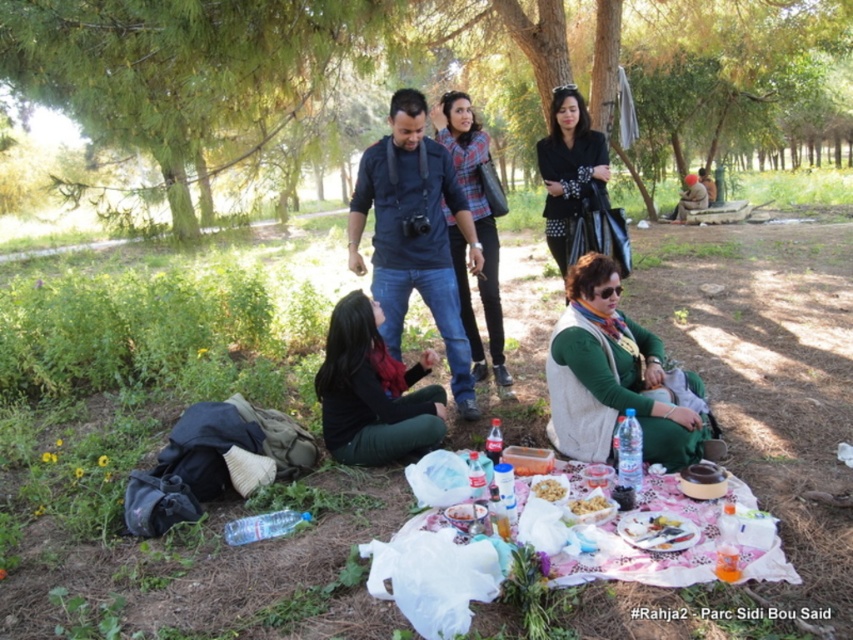
Can you confirm if black matte jacket at lower center is shorter than brown leather jacket at upper right?

Yes.

Is black matte jacket at lower center to the right of brown leather jacket at upper right from the viewer's perspective?

No, black matte jacket at lower center is not to the right of brown leather jacket at upper right.

Between point (328, 346) and point (700, 204), which one is positioned in front?

Point (328, 346) is more forward.

Find the location of a particular element. The width and height of the screenshot is (853, 640). black matte jacket at lower center is located at coordinates (373, 392).

Is green matte vest at center further to the viewer compared to plaid fabric shirt at center?

No, green matte vest at center is in front of plaid fabric shirt at center.

Who is more distant from viewer, (592, 272) or (489, 234)?

Point (489, 234)

The height and width of the screenshot is (640, 853). I want to click on green matte vest at center, so (610, 376).

Looking at this image, is black matte jacket at lower center to the left of plaid fabric shirt at center from the viewer's perspective?

Yes, black matte jacket at lower center is to the left of plaid fabric shirt at center.

Does black matte jacket at lower center have a greater width compared to plaid fabric shirt at center?

Correct, the width of black matte jacket at lower center exceeds that of plaid fabric shirt at center.

The height and width of the screenshot is (640, 853). Describe the element at coordinates (373, 392) in the screenshot. I see `black matte jacket at lower center` at that location.

The image size is (853, 640). Find the location of `black matte jacket at lower center`. black matte jacket at lower center is located at coordinates (373, 392).